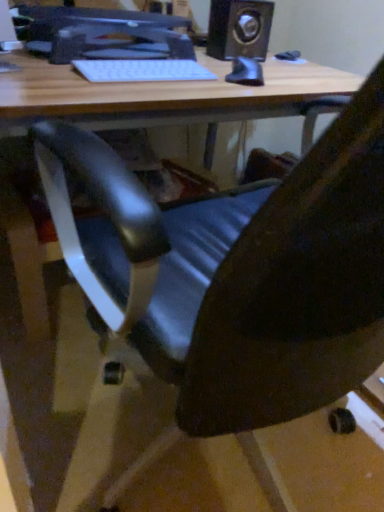
Question: From a real-world perspective, is white matte keyboard at upper center below matte black monitor at upper center?

Choices:
 (A) no
 (B) yes

Answer: (B)

Question: Does white matte keyboard at upper center turn towards matte black monitor at upper center?

Choices:
 (A) no
 (B) yes

Answer: (A)

Question: Is white matte keyboard at upper center touching matte black monitor at upper center?

Choices:
 (A) yes
 (B) no

Answer: (B)

Question: From the image's perspective, is white matte keyboard at upper center located above matte black monitor at upper center?

Choices:
 (A) yes
 (B) no

Answer: (B)

Question: Can you confirm if white matte keyboard at upper center is wider than matte black monitor at upper center?

Choices:
 (A) yes
 (B) no

Answer: (B)

Question: From a real-world perspective, does white matte keyboard at upper center stand above matte black monitor at upper center?

Choices:
 (A) no
 (B) yes

Answer: (A)

Question: Can you confirm if black plastic speaker at upper right is smaller than white matte keyboard at upper center?

Choices:
 (A) yes
 (B) no

Answer: (B)

Question: Is black plastic speaker at upper right not close to white matte keyboard at upper center?

Choices:
 (A) yes
 (B) no

Answer: (B)

Question: From the image's perspective, is black plastic speaker at upper right located above white matte keyboard at upper center?

Choices:
 (A) no
 (B) yes

Answer: (B)

Question: Is black plastic speaker at upper right thinner than white matte keyboard at upper center?

Choices:
 (A) no
 (B) yes

Answer: (A)

Question: Does black plastic speaker at upper right have a greater width compared to white matte keyboard at upper center?

Choices:
 (A) yes
 (B) no

Answer: (A)

Question: Is black plastic speaker at upper right next to white matte keyboard at upper center and touching it?

Choices:
 (A) no
 (B) yes

Answer: (A)

Question: Is matte black monitor at upper center further to camera compared to black plastic speaker at upper right?

Choices:
 (A) no
 (B) yes

Answer: (A)